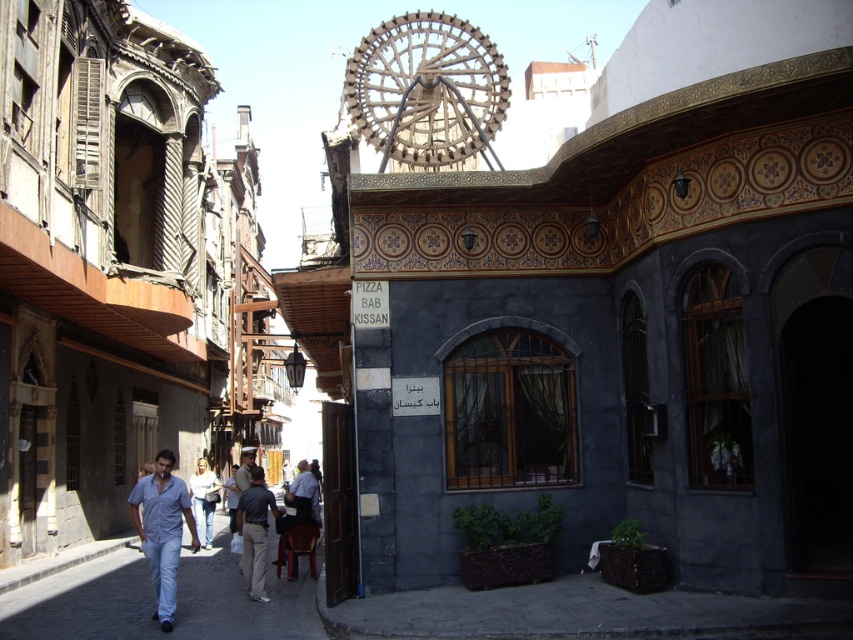
Question: Among these objects, which one is nearest to the camera?

Choices:
 (A) light blue jeans at lower left
 (B) wooden at upper center
 (C) dark gray pants at center
 (D) denim pants at center

Answer: (A)

Question: Which point is farther to the camera?

Choices:
 (A) denim pants at center
 (B) blue denim shirt at center
 (C) wooden at upper center
 (D) dark gray pants at center

Answer: (A)

Question: Does wooden at upper center lie in front of denim pants at center?

Choices:
 (A) no
 (B) yes

Answer: (B)

Question: Which of the following is the farthest from the observer?

Choices:
 (A) wooden at upper center
 (B) dark gray pants at center

Answer: (A)

Question: Can you confirm if light blue jeans at lower left is thinner than blue denim shirt at center?

Choices:
 (A) no
 (B) yes

Answer: (A)

Question: Does blue denim shirt at center have a lesser width compared to denim pants at center?

Choices:
 (A) no
 (B) yes

Answer: (A)